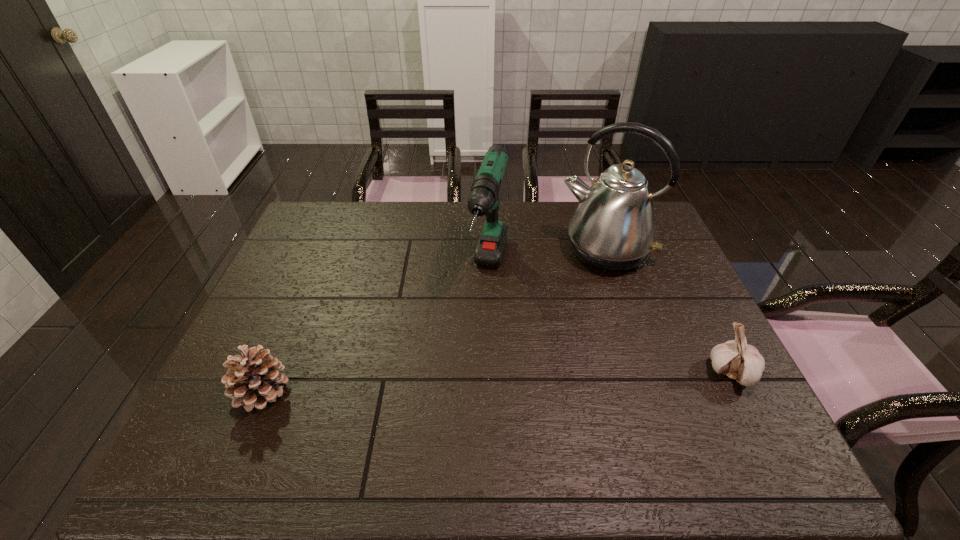
I want to click on free space on the desktop that is between the pinecone and the garlic and is positioned on the handle side of the drill, so click(x=459, y=384).

The height and width of the screenshot is (540, 960). I want to click on free space on the desktop that is between the leftmost object and the garlic and is positioned from the spout of the tallest object, so click(x=541, y=381).